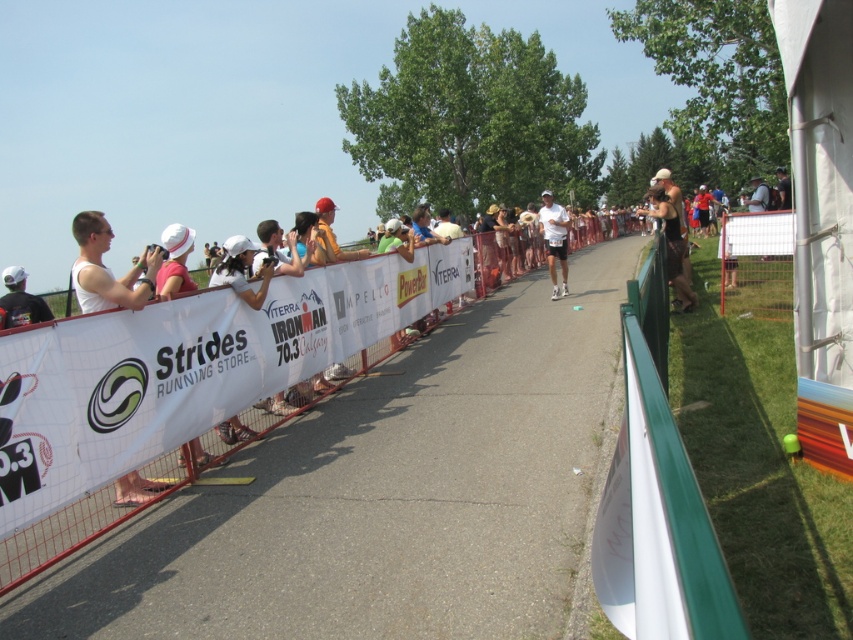
Which is behind, point (90, 259) or point (660, 218)?

The point (660, 218) is more distant.

Does white tank top at left have a lesser width compared to matte black helmet at upper right?

Yes.

The height and width of the screenshot is (640, 853). Describe the element at coordinates (108, 268) in the screenshot. I see `white tank top at left` at that location.

Locate an element on the screen. white tank top at left is located at coordinates (108, 268).

Is white fabric banner at center thinner than black matte backpack at left?

Incorrect, white fabric banner at center's width is not less than black matte backpack at left's.

Is white fabric banner at center shorter than black matte backpack at left?

No.

The image size is (853, 640). What do you see at coordinates (56, 538) in the screenshot?
I see `white fabric banner at center` at bounding box center [56, 538].

You are a GUI agent. You are given a task and a screenshot of the screen. Output one action in this format:
    pyautogui.click(x=<x>, y=<y>)
    Task: Click on the white fabric banner at center
    The width and height of the screenshot is (853, 640).
    Given the screenshot: What is the action you would take?
    pyautogui.click(x=56, y=538)

Can you confirm if white fabric banner at center is shorter than matte black helmet at upper right?

Correct, white fabric banner at center is not as tall as matte black helmet at upper right.

Between white fabric banner at center and matte black helmet at upper right, which one appears on the right side from the viewer's perspective?

Positioned to the right is matte black helmet at upper right.

The image size is (853, 640). Find the location of `white fabric banner at center`. white fabric banner at center is located at coordinates (56, 538).